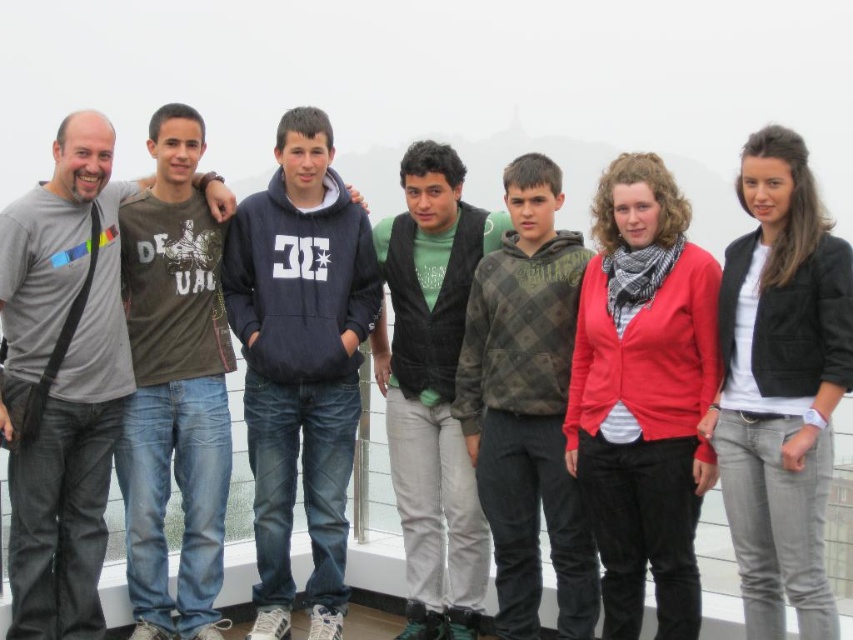
Who is shorter, gray t-shirt at left or dark green t-shirt at center?

With less height is gray t-shirt at left.

Between gray t-shirt at left and dark green t-shirt at center, which one has more height?

dark green t-shirt at center is taller.

At what (x,y) coordinates should I click in order to perform the action: click on gray t-shirt at left. Please return your answer as a coordinate pair (x, y). The image size is (853, 640). Looking at the image, I should click on (62, 380).

The height and width of the screenshot is (640, 853). Find the location of `gray t-shirt at left`. gray t-shirt at left is located at coordinates coord(62,380).

Does gray t-shirt at left appear over dark green sweater at center?

Incorrect, gray t-shirt at left is not positioned above dark green sweater at center.

Is point (41, 452) farther from viewer compared to point (412, 572)?

No, it is in front of (412, 572).

The width and height of the screenshot is (853, 640). What are the coordinates of `gray t-shirt at left` in the screenshot? It's located at (62, 380).

Consider the image. Does dark green t-shirt at center have a smaller size compared to dark green sweater at center?

No.

Between point (155, 246) and point (398, 381), which one is positioned in front?

Point (155, 246) is more forward.

Between point (218, 547) and point (460, 472), which one is positioned behind?

Point (460, 472)

Where is `dark green t-shirt at center`? This screenshot has height=640, width=853. dark green t-shirt at center is located at coordinates (175, 384).